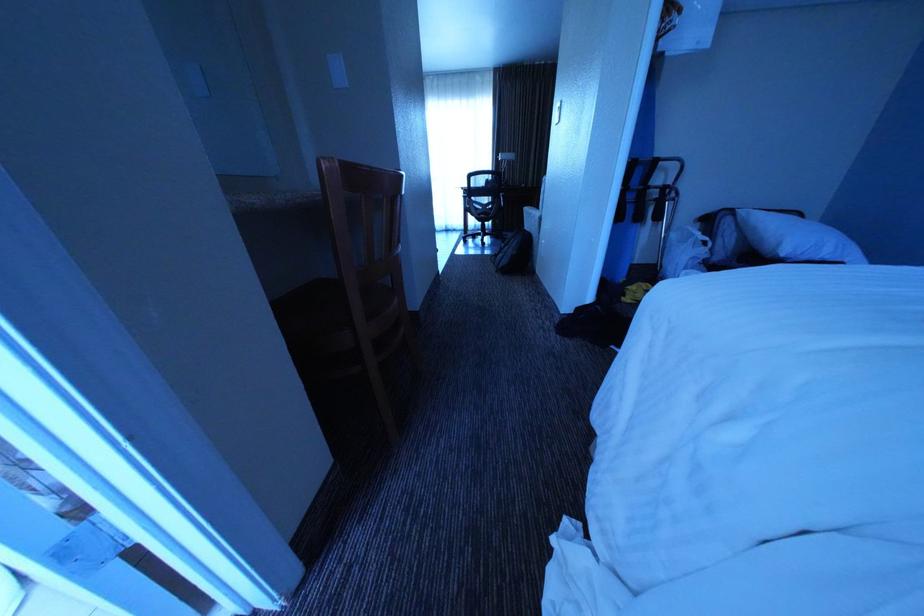
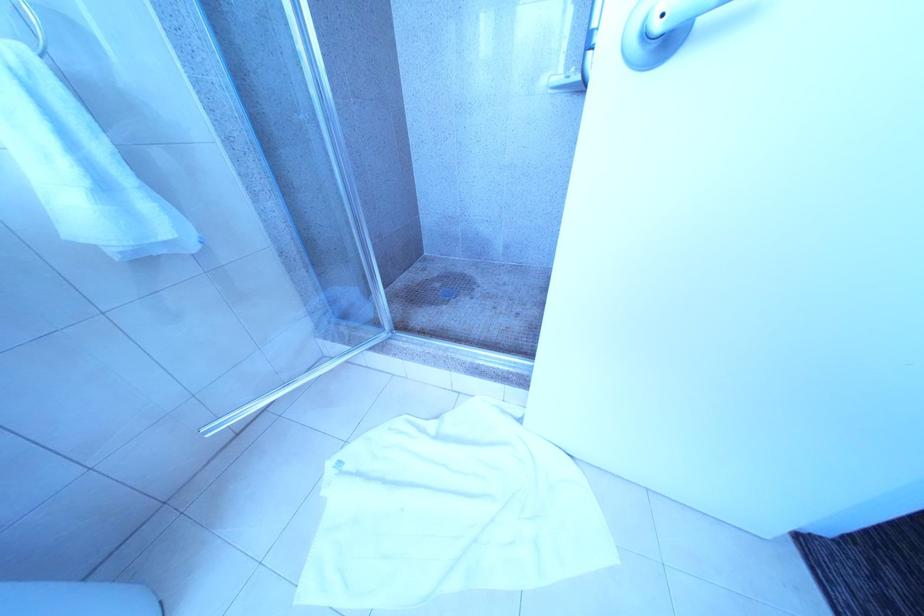
Question: Which direction would the cameraman need to move to produce the second image? Reply with the corresponding letter.

Choices:
 (A) Left
 (B) Right
 (C) Forward
 (D) Backward

Answer: (A)